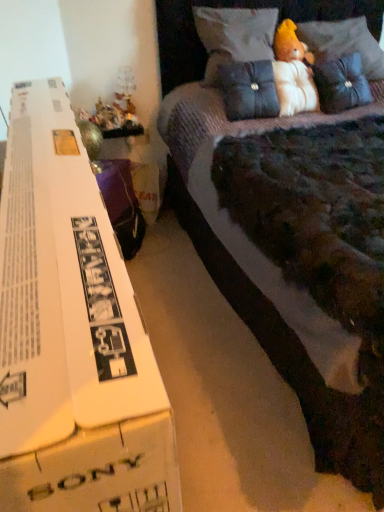
At what (x,y) coordinates should I click in order to perform the action: click on free space above white cardboard box at left (from a real-world perspective). Please return your answer as a coordinate pair (x, y). Image resolution: width=384 pixels, height=512 pixels. Looking at the image, I should click on (51, 163).